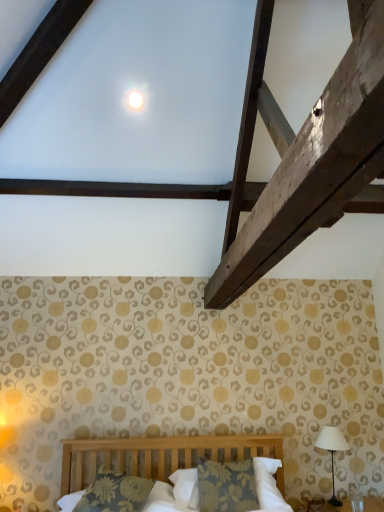
Question: Considering the positions of floral-patterned fabric pillow at center, the 1th pillow from the left, and white glossy moonlight at upper center in the image, is floral-patterned fabric pillow at center, the 1th pillow from the left, taller or shorter than white glossy moonlight at upper center?

Choices:
 (A) short
 (B) tall

Answer: (B)

Question: From the image's perspective, is floral-patterned fabric pillow at center, the 1th pillow from the left, located above or below white glossy moonlight at upper center?

Choices:
 (A) above
 (B) below

Answer: (B)

Question: Considering the real-world distances, which object is farthest from the floral fabric pillow at center, marked as the first pillow in a right-to-left arrangement?

Choices:
 (A) floral-patterned fabric pillow at center, the 1th pillow from the left
 (B) white fabric-covered lampshade at right
 (C) white glossy moonlight at upper center

Answer: (C)

Question: Estimate the real-world distances between objects in this image. Which object is closer to the white fabric-covered lampshade at right?

Choices:
 (A) white glossy moonlight at upper center
 (B) floral fabric pillow at center, the 2th pillow from the left
 (C) floral-patterned fabric pillow at center, positioned as the second pillow in right-to-left order

Answer: (B)